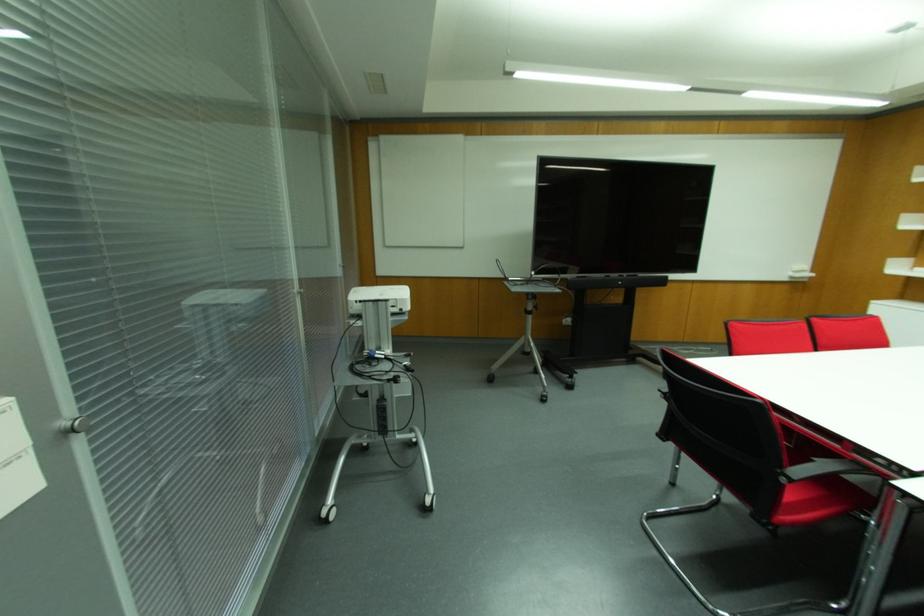
The height and width of the screenshot is (616, 924). I want to click on silver blind knob, so click(x=74, y=424).